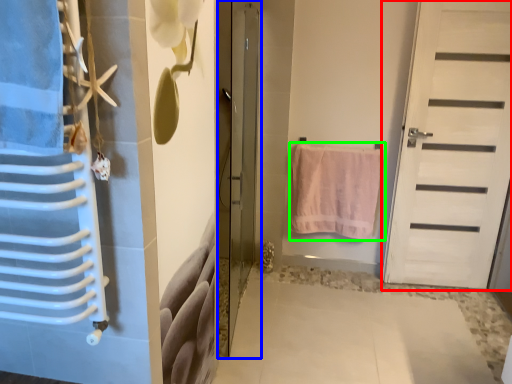
Question: Which is farther away from door (highlighted by a red box)? door (highlighted by a blue box) or towel (highlighted by a green box)?

Choices:
 (A) door
 (B) towel

Answer: (A)